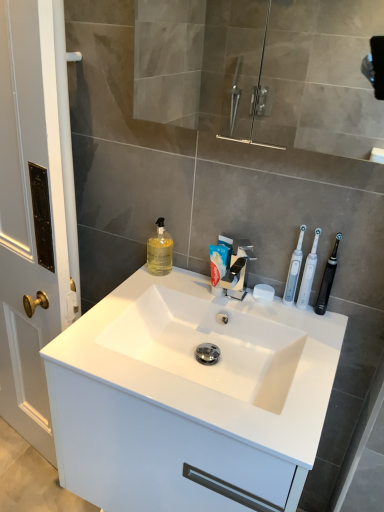
Where is `free space between translucent yellow liquid at sink left and white plastic toothbrush at right, the second toothbrush positioned from the left`? free space between translucent yellow liquid at sink left and white plastic toothbrush at right, the second toothbrush positioned from the left is located at coordinates (205, 284).